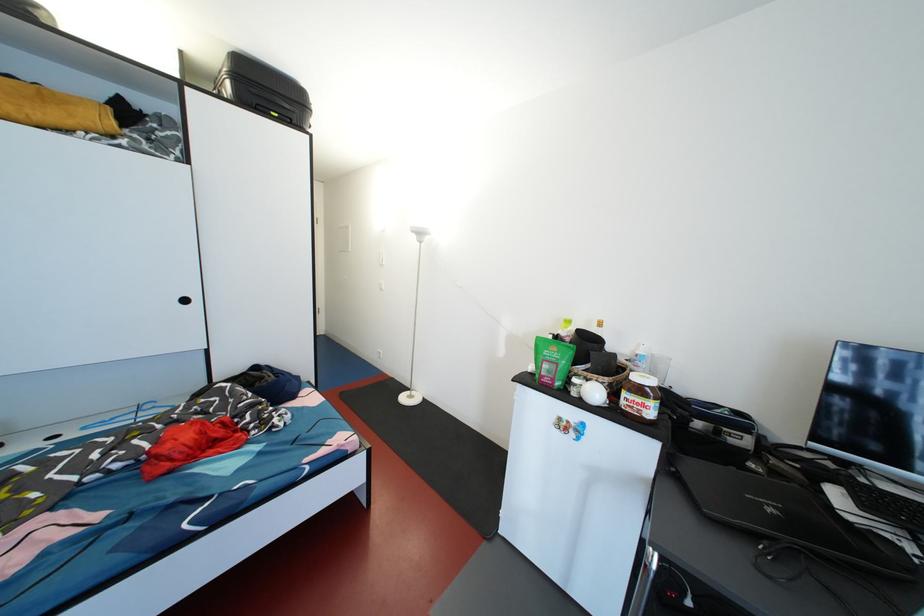
Identify the location of closed black laptop. (785, 516).